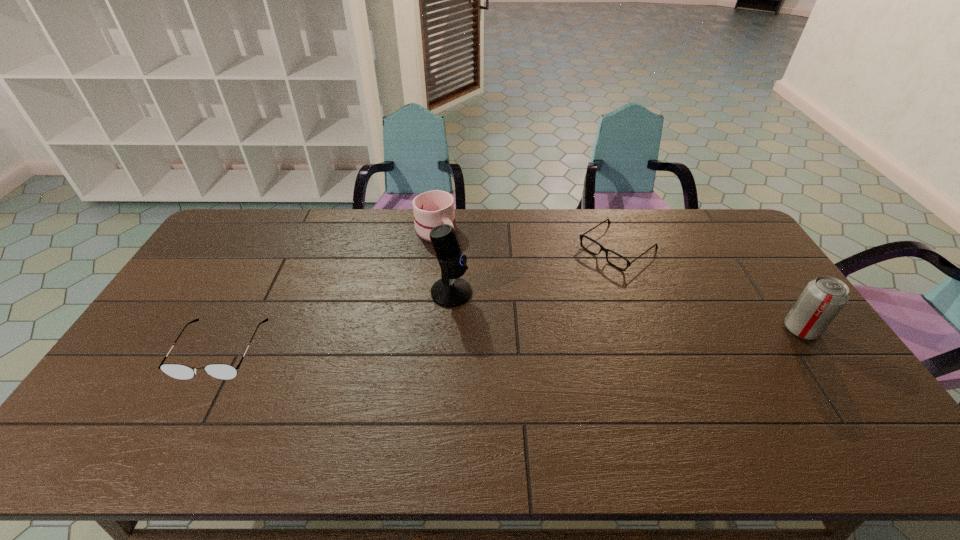
At what (x,y) coordinates should I click in order to perform the action: click on spectacles present at the far edge. Please return your answer as a coordinate pair (x, y). Looking at the image, I should click on (581, 236).

This screenshot has height=540, width=960. In order to click on mug located in the far edge section of the desktop in this screenshot , I will do `click(433, 208)`.

Locate an element on the screen. The image size is (960, 540). object that is at the left edge is located at coordinates (179, 371).

At what (x,y) coordinates should I click in order to perform the action: click on object that is at the right edge. Please return your answer as a coordinate pair (x, y). Looking at the image, I should click on tap(823, 298).

Where is `vacant area at the far edge`? The image size is (960, 540). vacant area at the far edge is located at coordinates (414, 225).

In the image, there is a desktop. Identify the location of vacant space at the near edge. (492, 413).

Where is `free space at the left edge of the desktop`? The height and width of the screenshot is (540, 960). free space at the left edge of the desktop is located at coordinates (178, 343).

In the image, there is a desktop. At what (x,y) coordinates should I click in order to perform the action: click on free space at the right edge. Please return your answer as a coordinate pair (x, y). This screenshot has width=960, height=540. Looking at the image, I should click on (793, 373).

Locate an element on the screen. vacant point at the far right corner is located at coordinates (685, 215).

Where is `unoccupied area between the left spectacles and the soda can`? The image size is (960, 540). unoccupied area between the left spectacles and the soda can is located at coordinates (511, 340).